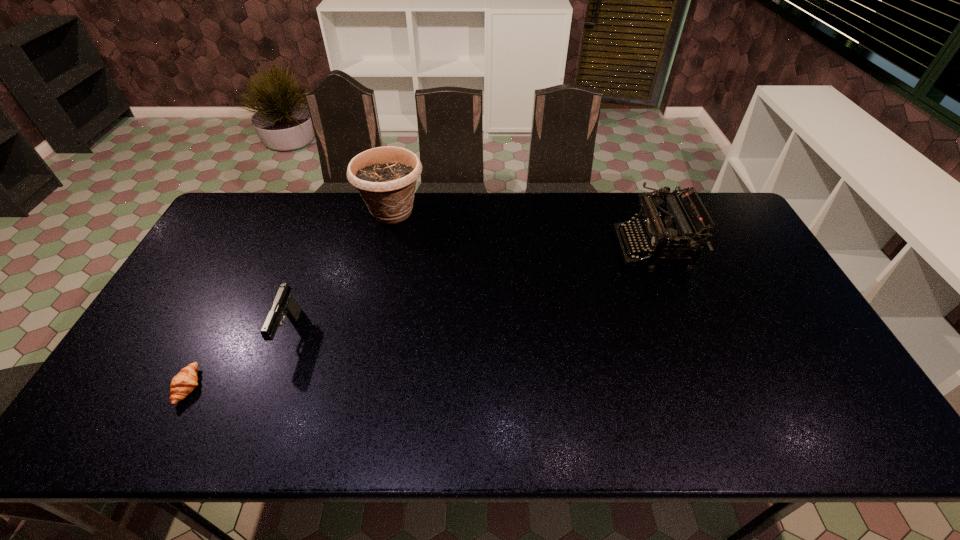
Locate an element on the screen. The image size is (960, 540). unoccupied position between the third object from left to right and the rightmost object is located at coordinates (522, 230).

The image size is (960, 540). Identify the location of vacant region between the nearest object and the rightmost object. (420, 318).

You are a GUI agent. You are given a task and a screenshot of the screen. Output one action in this format:
    pyautogui.click(x=<x>, y=<y>)
    Task: Click on the third closest object to the leftmost object
    
    Given the screenshot: What is the action you would take?
    pyautogui.click(x=655, y=226)

Identify the location of object that is the second closest to the typewriter. (284, 304).